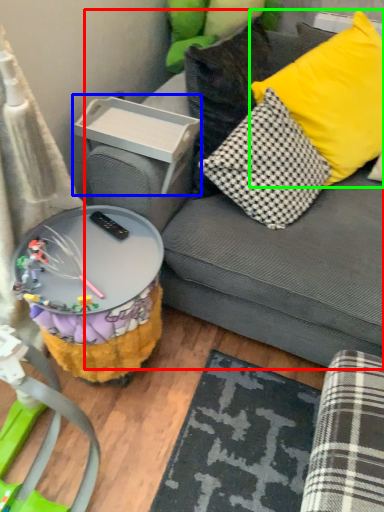
Question: Estimate the real-world distances between objects in this image. Which object is closer to studio couch (highlighted by a red box), storage box (highlighted by a blue box) or pillow (highlighted by a green box)?

Choices:
 (A) storage box
 (B) pillow

Answer: (B)